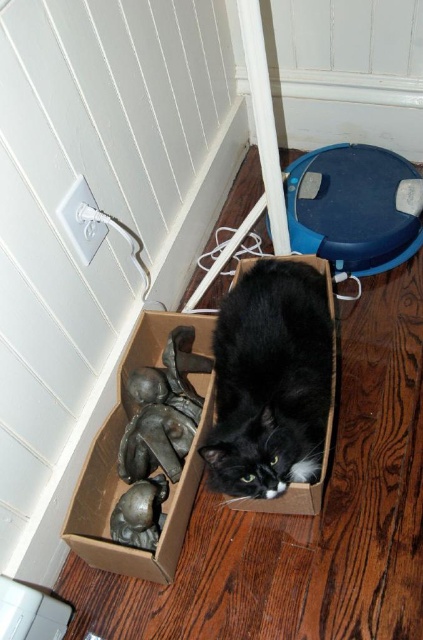
Is the position of black soft fur cat at center more distant than that of brown cardboard box at lower center?

That is False.

Looking at this image, between black soft fur cat at center and brown cardboard box at lower center, which one appears on the left side from the viewer's perspective?

brown cardboard box at lower center

Does point (258, 264) lie in front of point (126, 348)?

No, (258, 264) is further to viewer.

What are the coordinates of `black soft fur cat at center` in the screenshot? It's located at (271, 380).